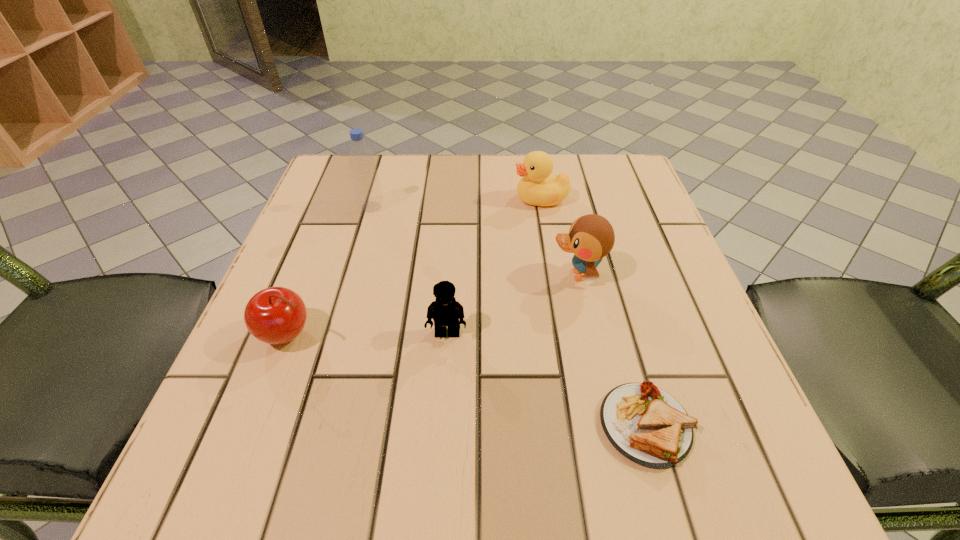
Where is `vacant space at the near left corner of the desktop`? vacant space at the near left corner of the desktop is located at coordinates (230, 457).

In the image, there is a desktop. Identify the location of vacant region at the far right corner. The height and width of the screenshot is (540, 960). (644, 187).

Where is `free space at the near right corner of the desktop`? This screenshot has width=960, height=540. free space at the near right corner of the desktop is located at coordinates (767, 500).

Locate an element on the screen. The image size is (960, 540). blank region between the nearest object and the third farthest object is located at coordinates (612, 350).

Where is `empty space between the sandwich and the farther duck`? This screenshot has height=540, width=960. empty space between the sandwich and the farther duck is located at coordinates (592, 312).

Find the location of `free space between the nearest object and the third object from left to right`. free space between the nearest object and the third object from left to right is located at coordinates (546, 379).

I want to click on vacant point located between the nearer duck and the shortest object, so click(612, 350).

You are a GUI agent. You are given a task and a screenshot of the screen. Output one action in this format:
    pyautogui.click(x=<x>, y=<y>)
    Task: Click on the free space that is in between the fourth object from right to left and the farther duck
    
    Given the screenshot: What is the action you would take?
    pyautogui.click(x=493, y=266)

You are a GUI agent. You are given a task and a screenshot of the screen. Output one action in this format:
    pyautogui.click(x=<x>, y=<y>)
    Task: Click on the empty space that is in between the farther duck and the bottle
    
    Given the screenshot: What is the action you would take?
    pyautogui.click(x=456, y=203)

The image size is (960, 540). What are the coordinates of `vacant region between the cherry and the sandwich` in the screenshot? It's located at (467, 380).